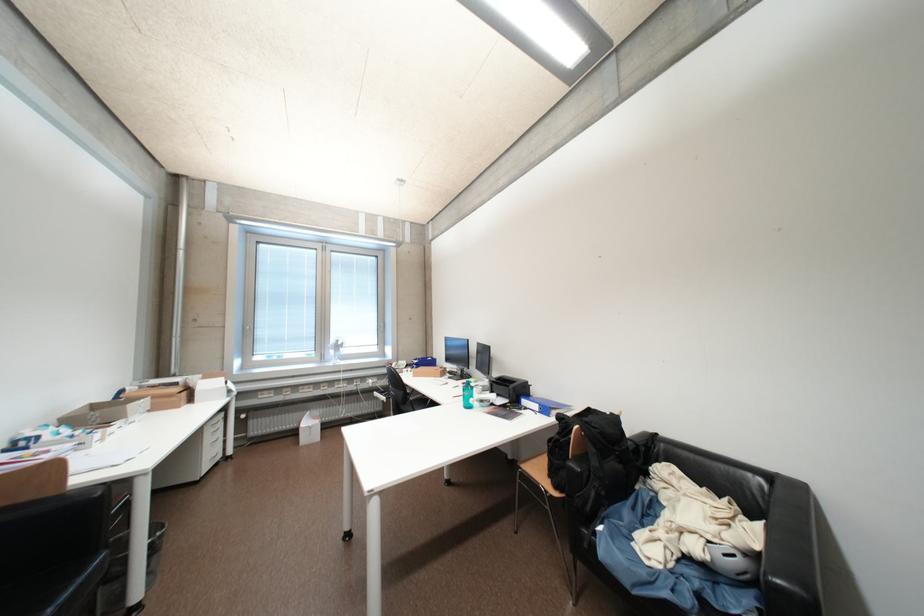
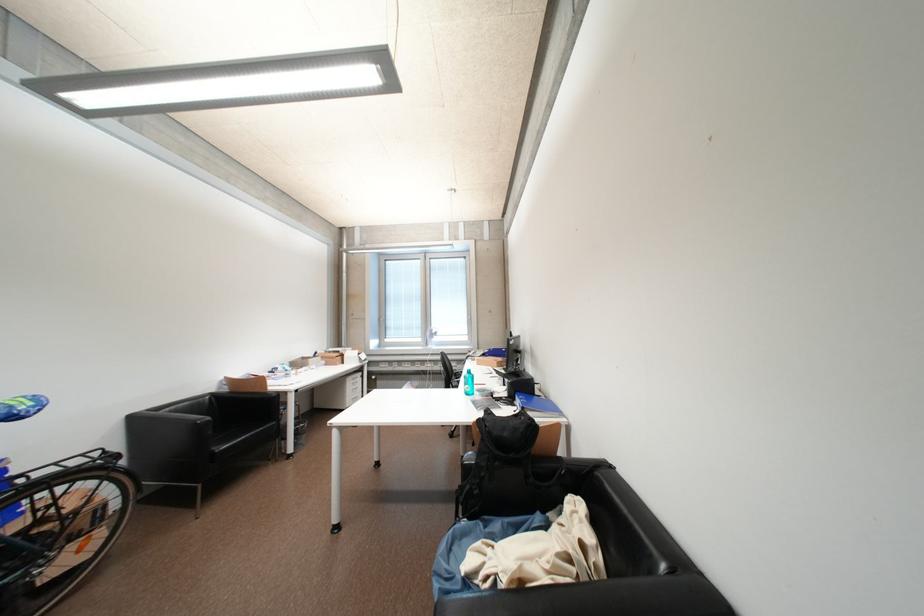
Find the pixel in the second image that matches the point at 647,539 in the first image.

(487, 546)